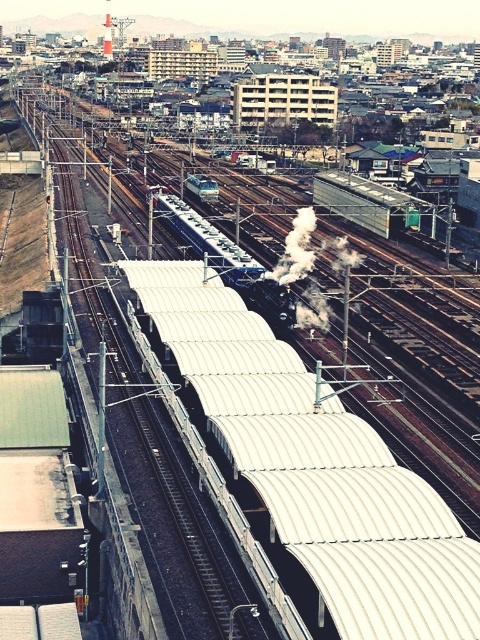
Can you confirm if white corrugated roof at center is taller than white smoke at center?

No.

Is the position of white corrugated roof at center less distant than that of white smoke at center?

Yes, white corrugated roof at center is closer to the viewer.

Does point (342, 506) come behind point (347, 321)?

No, it is not.

This screenshot has width=480, height=640. Identify the location of white corrugated roof at center. (309, 470).